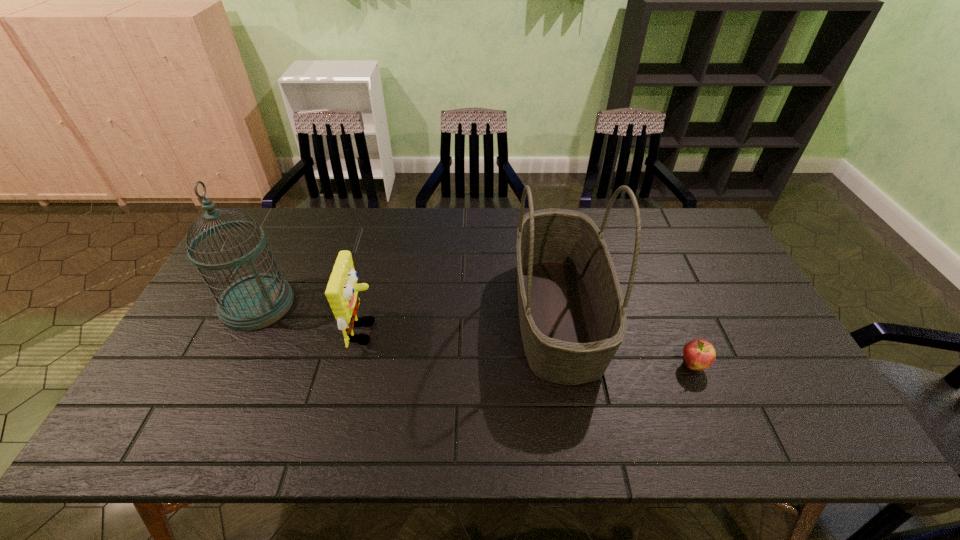
Locate an element on the screen. free spot between the apple and the birdcage is located at coordinates (475, 335).

Locate an element on the screen. Image resolution: width=960 pixels, height=540 pixels. free point between the basket and the third tallest object is located at coordinates (462, 323).

Identify which object is the second closest to the shortest object. Please provide its 2D coordinates. Your answer should be formatted as a tuple, i.e. [(x, y)], where the tuple contains the x and y coordinates of a point satisfying the conditions above.

[(342, 289)]

Image resolution: width=960 pixels, height=540 pixels. Find the location of `object that is the second closest to the third object from right to left`. object that is the second closest to the third object from right to left is located at coordinates (572, 315).

Find the location of a particular element. vacant space that satisfies the following two spatial constraints: 1. on the front-facing side of the third object from left to right; 2. on the left side of the leftmost object is located at coordinates (252, 314).

Locate an element on the screen. This screenshot has height=540, width=960. vacant region that satisfies the following two spatial constraints: 1. on the back side of the apple; 2. on the front-facing side of the leftmost object is located at coordinates (667, 304).

Identify the location of vacant space that satisfies the following two spatial constraints: 1. on the front-facing side of the basket; 2. on the right side of the leftmost object. (252, 314).

What are the coordinates of `free space that satisfies the following two spatial constraints: 1. on the face of the third object from right to left; 2. on the back side of the apple` in the screenshot? It's located at (357, 366).

I want to click on free space that satisfies the following two spatial constraints: 1. on the back side of the apple; 2. on the face of the third tallest object, so click(x=679, y=332).

Where is `vacant area in the image that satisfies the following two spatial constraints: 1. on the front side of the rightmost object; 2. on the left side of the basket`? Image resolution: width=960 pixels, height=540 pixels. vacant area in the image that satisfies the following two spatial constraints: 1. on the front side of the rightmost object; 2. on the left side of the basket is located at coordinates (567, 366).